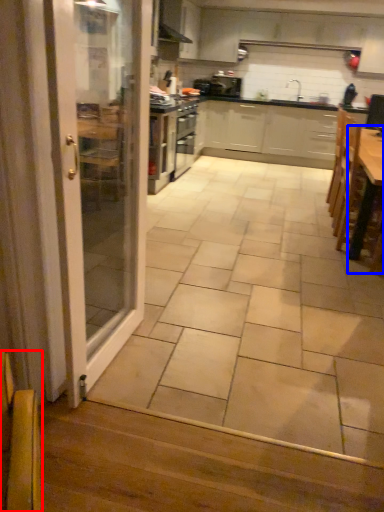
Question: Which object appears closest to the camera in this image, armchair (highlighted by a red box) or table (highlighted by a blue box)?

Choices:
 (A) armchair
 (B) table

Answer: (A)